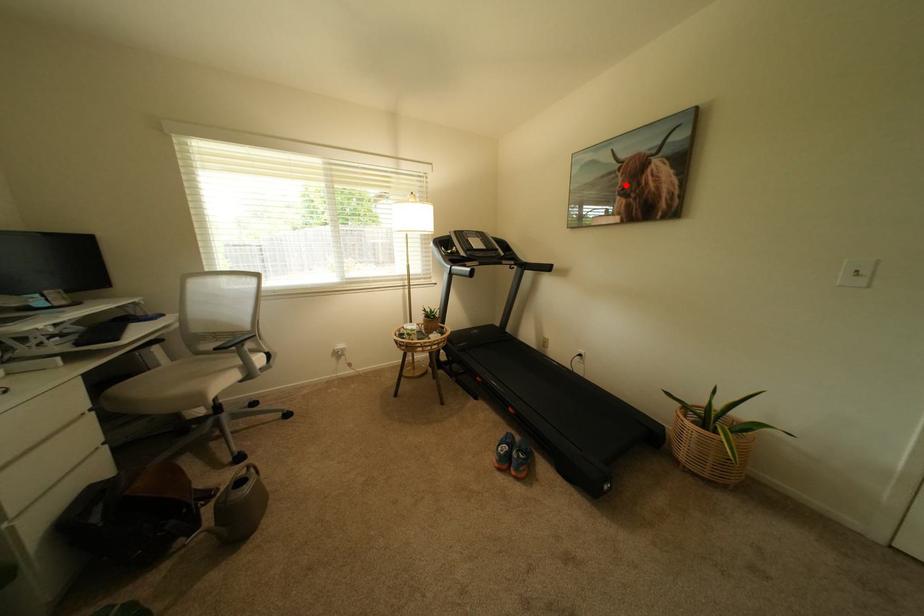
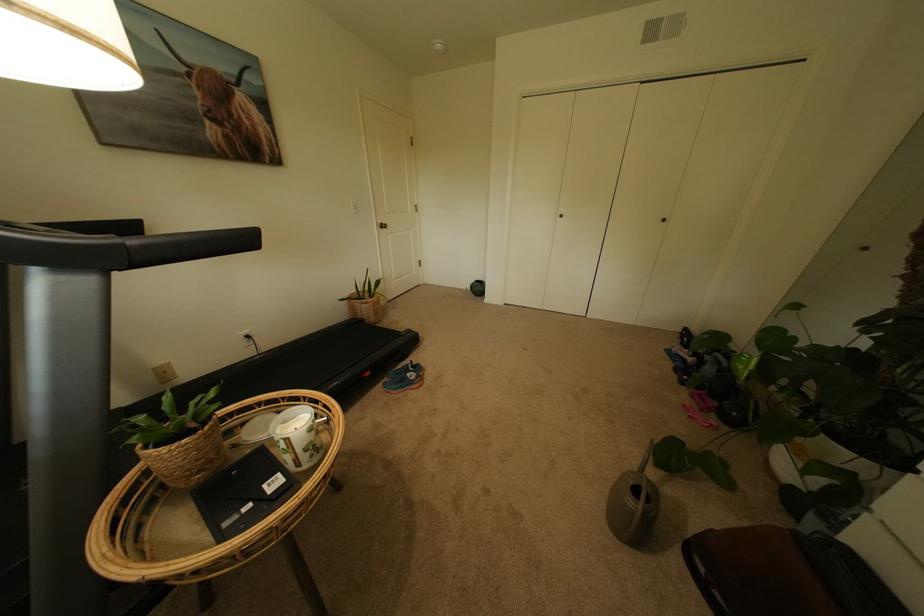
The point at the highlighted location is marked in the first image. Where is the corresponding point in the second image?

(204, 100)